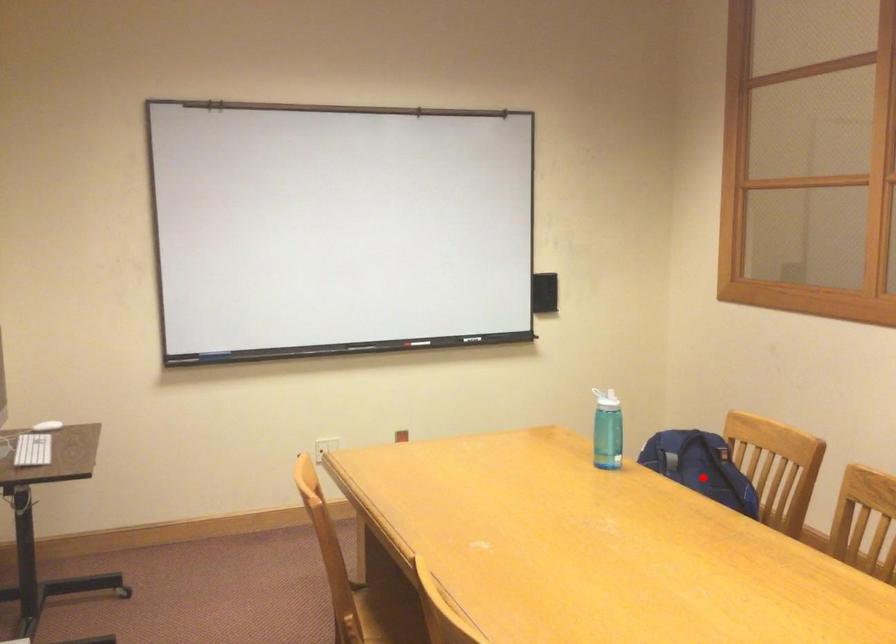
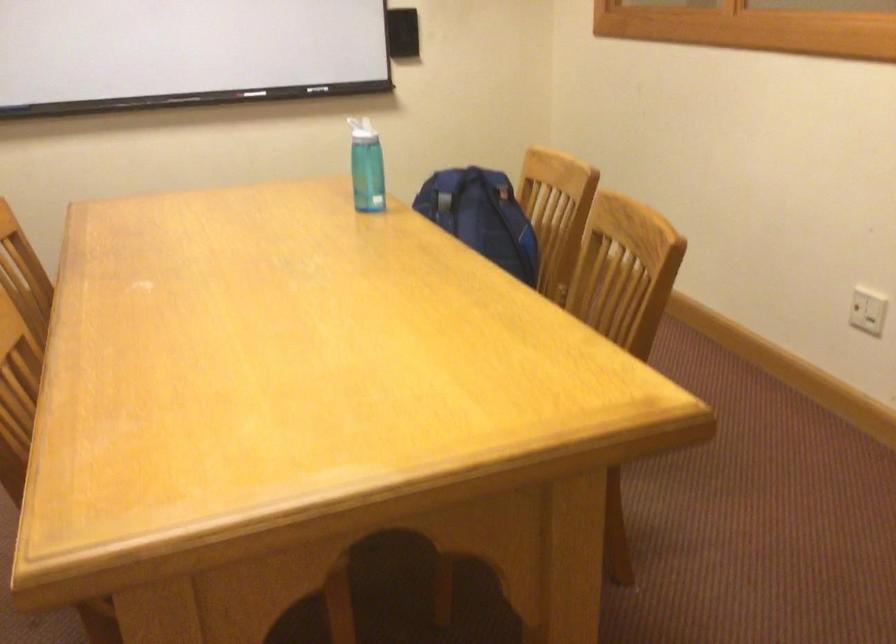
In the second image, find the point that corresponds to the highlighted location in the first image.

(481, 216)